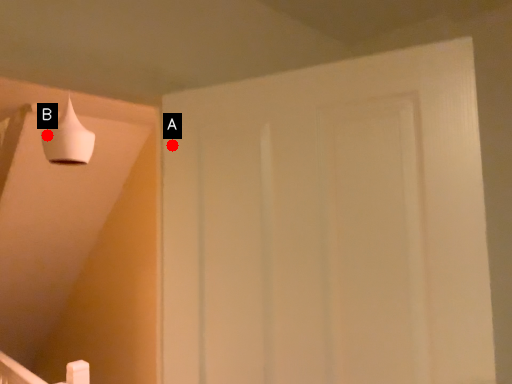
Question: Two points are circled on the image, labeled by A and B beside each circle. Which point is farther from the camera taking this photo?

Choices:
 (A) A is further
 (B) B is further

Answer: (B)